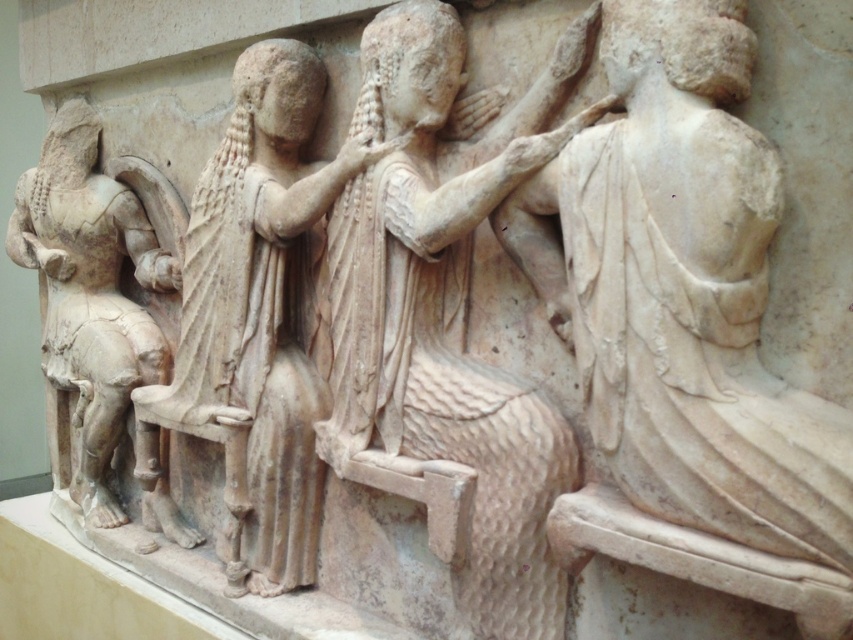
Between point (349, 252) and point (248, 474), which one is positioned behind?

Point (248, 474)

Who is positioned more to the left, smooth beige statue at center or matte stone figure at center?

matte stone figure at center

Describe the element at coordinates (447, 314) in the screenshot. I see `smooth beige statue at center` at that location.

The height and width of the screenshot is (640, 853). I want to click on smooth beige statue at center, so click(447, 314).

Which is above, white marble draped cloth at right or smooth beige statue at center?

smooth beige statue at center is above.

Does white marble draped cloth at right have a lesser width compared to smooth beige statue at center?

Yes.

Locate an element on the screen. white marble draped cloth at right is located at coordinates (683, 328).

Locate an element on the screen. Image resolution: width=853 pixels, height=640 pixels. white marble draped cloth at right is located at coordinates (683, 328).

Is matte stone figure at center further to camera compared to white marble figure at left?

No, matte stone figure at center is in front of white marble figure at left.

Can you confirm if matte stone figure at center is thinner than white marble figure at left?

No, matte stone figure at center is not thinner than white marble figure at left.

Does point (279, 444) come farther from viewer compared to point (151, 284)?

No, it is in front of (151, 284).

Where is `matte stone figure at center`? The height and width of the screenshot is (640, 853). matte stone figure at center is located at coordinates (259, 317).